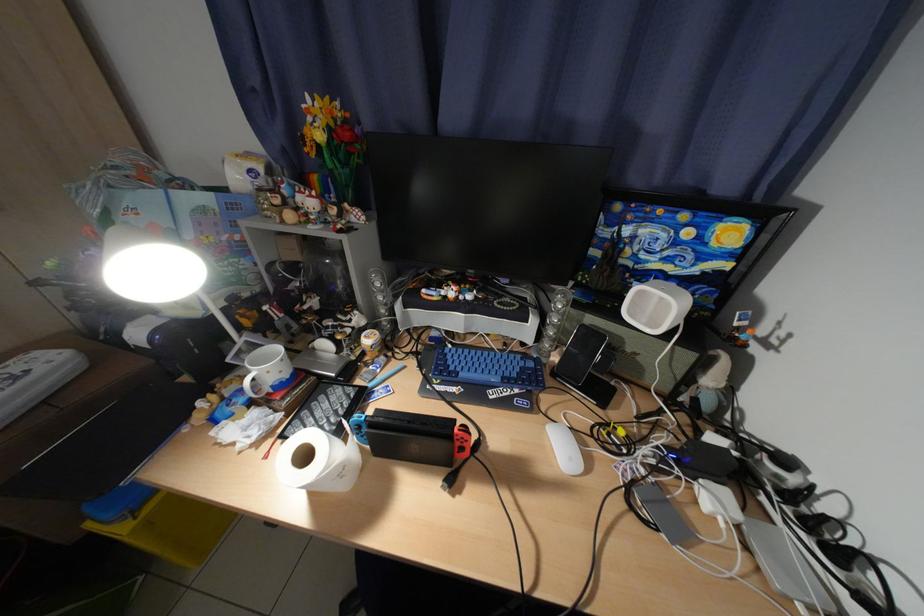
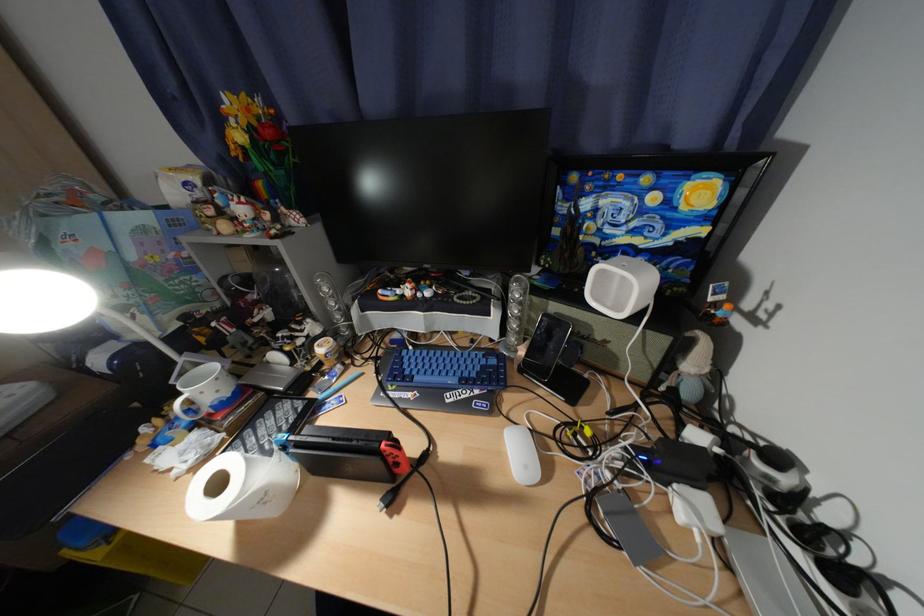
Locate, in the second image, the point that corresponds to point 582,460 in the first image.

(538, 469)